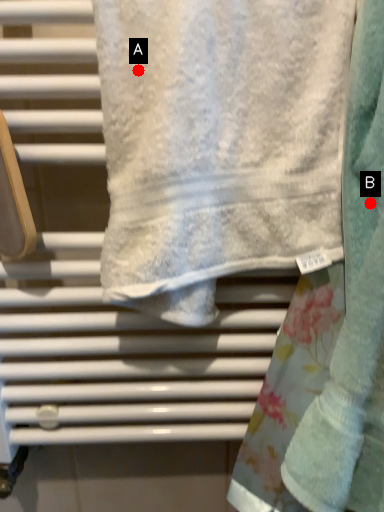
Question: Two points are circled on the image, labeled by A and B beside each circle. Which of the following is the closest to the observer?

Choices:
 (A) A is closer
 (B) B is closer

Answer: (A)